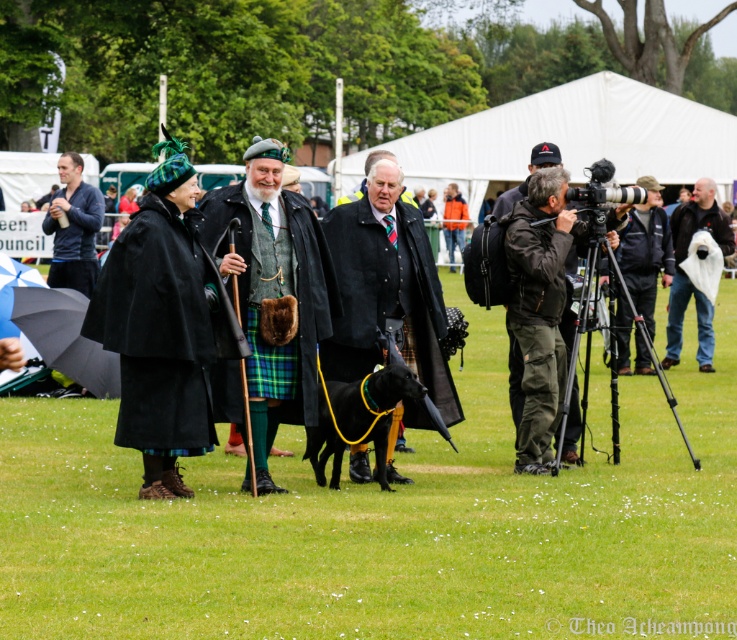
You are standing at the viewpoint of the image and want to reach the point marked as point (184, 310). If your walking speed is 3 feet per second, how many seconds will it take you to reach there?

The distance between you and point (184, 310) is 46.51 feet. At a speed of 3 feet per second, it will take approximately 15.5 seconds to reach there.

You are organizing a parade route and need to know if the green woolen kilt at center can pass through an opening that is just wide enough for the white fabric bag at right. Based on the scene, will the kilt fit through the opening?

The green woolen kilt at center is wider than the white fabric bag at right, so it will not fit through an opening that accommodates the bag.

You are a photographer at the event and want to capture a clear photo of both the black suede cape at center and the black matte dog at center. However, the dog is moving around. Which object should you focus on first to ensure it stays in frame?

The black suede cape at center is in front of the black matte dog at center, so you should focus on the black suede cape at center first to ensure it stays in frame.